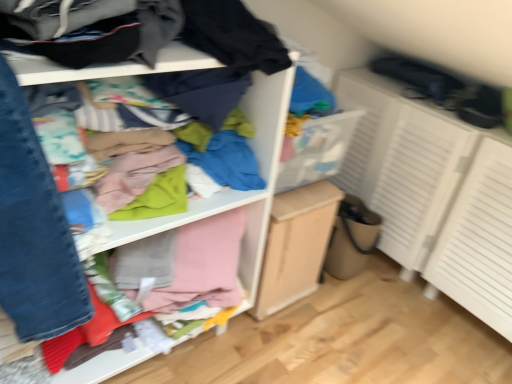
Question: Is the position of light wood/file cabinet at center less distant than that of white textured cabinet at right?

Choices:
 (A) yes
 (B) no

Answer: (B)

Question: Is light wood/file cabinet at center in contact with white textured cabinet at right?

Choices:
 (A) no
 (B) yes

Answer: (A)

Question: Is light wood/file cabinet at center aimed at white textured cabinet at right?

Choices:
 (A) yes
 (B) no

Answer: (B)

Question: Does light wood/file cabinet at center have a greater width compared to white textured cabinet at right?

Choices:
 (A) no
 (B) yes

Answer: (A)

Question: Is light wood/file cabinet at center positioned beyond the bounds of white textured cabinet at right?

Choices:
 (A) yes
 (B) no

Answer: (A)

Question: From a real-world perspective, is light wood/file cabinet at center located beneath white textured cabinet at right?

Choices:
 (A) no
 (B) yes

Answer: (B)

Question: Are cloth at upper left and white textured cabinet at right making contact?

Choices:
 (A) no
 (B) yes

Answer: (A)

Question: Would you say cloth at upper left is outside white textured cabinet at right?

Choices:
 (A) no
 (B) yes

Answer: (B)

Question: Can you confirm if cloth at upper left is thinner than white textured cabinet at right?

Choices:
 (A) no
 (B) yes

Answer: (B)

Question: Is cloth at upper left far from white textured cabinet at right?

Choices:
 (A) yes
 (B) no

Answer: (B)

Question: Is cloth at upper left behind white textured cabinet at right?

Choices:
 (A) yes
 (B) no

Answer: (B)

Question: Considering the relative positions of cloth at upper left and white textured cabinet at right in the image provided, is cloth at upper left to the left of white textured cabinet at right from the viewer's perspective?

Choices:
 (A) yes
 (B) no

Answer: (A)

Question: Is white textured cabinet at right at the right side of light wood/file cabinet at center?

Choices:
 (A) no
 (B) yes

Answer: (B)